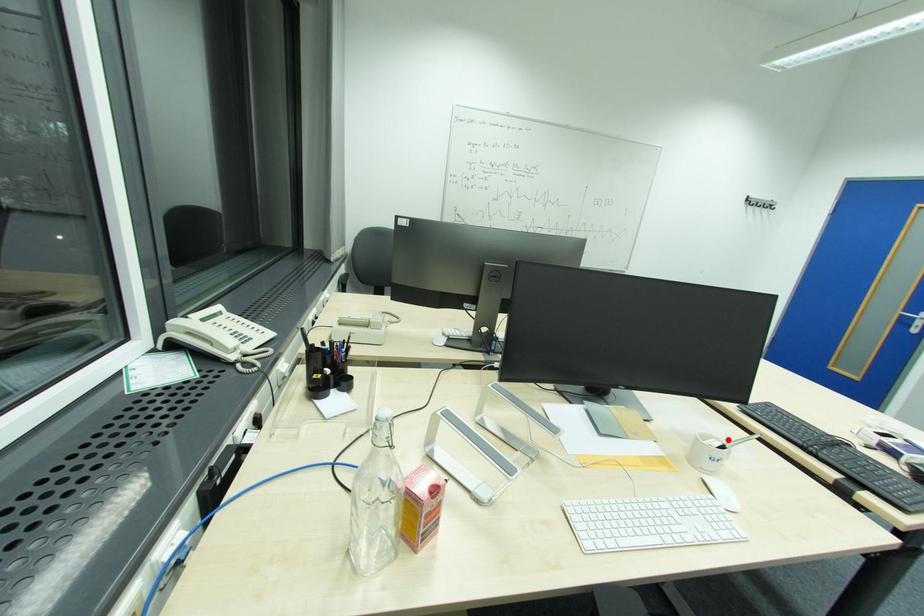
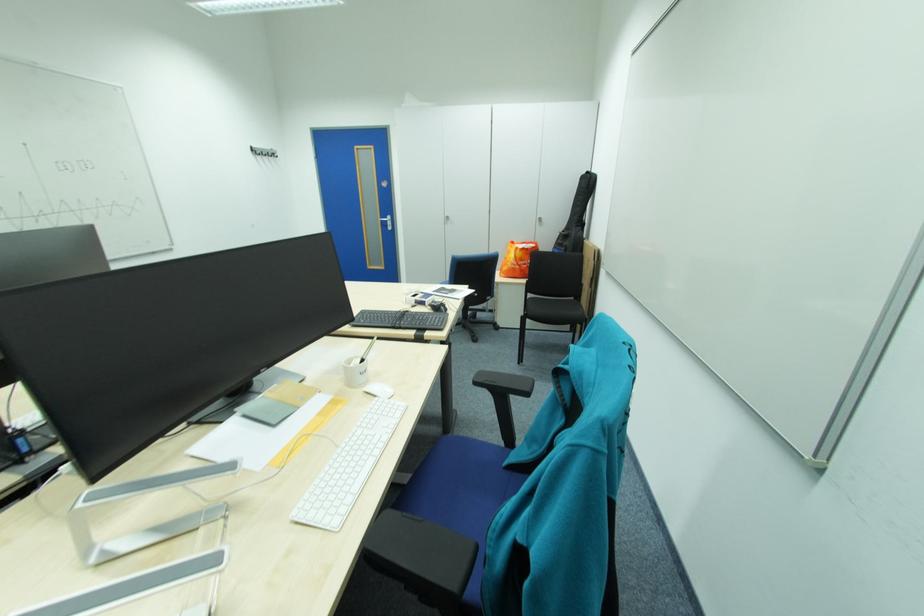
In the second image, find the point that corresponds to the highlighted location in the first image.

(367, 357)